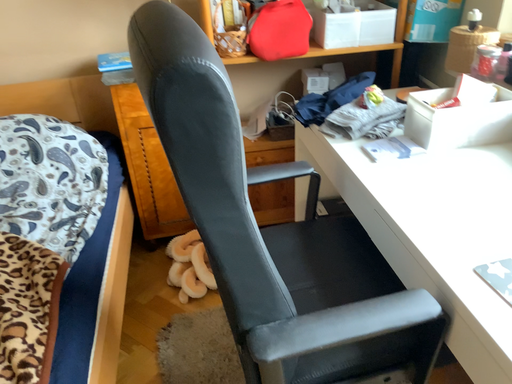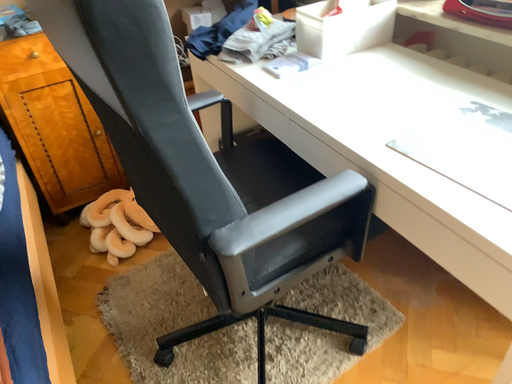
Question: Which way did the camera rotate in the video?

Choices:
 (A) rotated left
 (B) rotated right

Answer: (B)